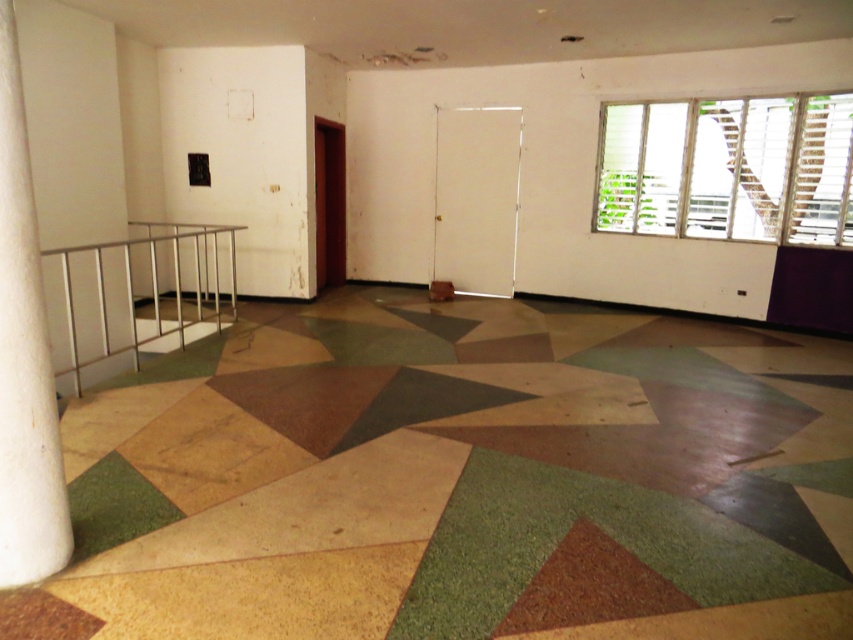
You are an interior designer assessing the space. You need to place a large decorative item that requires a stable support. Which object between the white marble pillar at left and the silver metallic balustrade at left would you choose for support, and why?

The silver metallic balustrade at left is larger than the white marble pillar at left, making it a more stable support for the large decorative item.